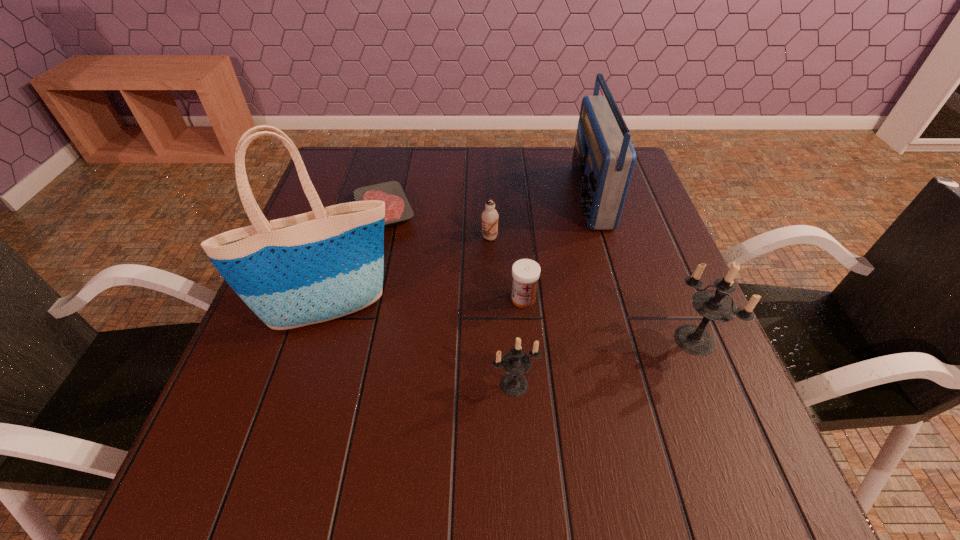
Identify the location of free space located on the left of the fourth tallest object. (311, 384).

Where is `free space located on the left of the right candle holder`? This screenshot has height=540, width=960. free space located on the left of the right candle holder is located at coordinates (505, 340).

Locate an element on the screen. This screenshot has width=960, height=540. vacant space situated on the front of the medicine is located at coordinates (526, 336).

Where is `vacant region located 0.100m on the front panel of the radio receiver`? The width and height of the screenshot is (960, 540). vacant region located 0.100m on the front panel of the radio receiver is located at coordinates (537, 196).

This screenshot has width=960, height=540. What are the coordinates of `vacant area situated on the front panel of the radio receiver` in the screenshot? It's located at (487, 196).

Find the location of a particular element. The width and height of the screenshot is (960, 540). vacant point located on the front panel of the radio receiver is located at coordinates (519, 196).

Find the location of a particular element. The image size is (960, 540). vacant region located on the right of the shortest object is located at coordinates (482, 210).

Find the location of a particular element. blank area located 0.170m on the front of the tallest object is located at coordinates (298, 420).

The height and width of the screenshot is (540, 960). I want to click on vacant space located on the left of the third shortest object, so click(417, 238).

Find the location of a particular element. radio receiver situated at the far edge is located at coordinates (603, 161).